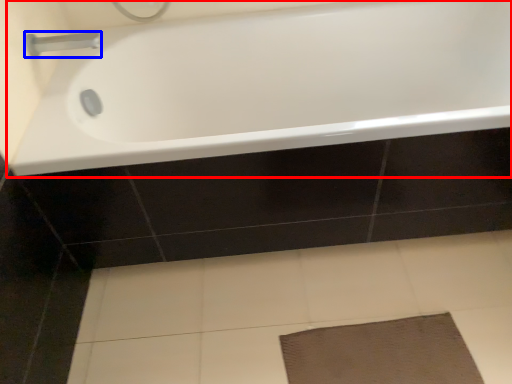
Question: Which object is closer to the camera taking this photo, bathtub (highlighted by a red box) or tap (highlighted by a blue box)?

Choices:
 (A) bathtub
 (B) tap

Answer: (A)